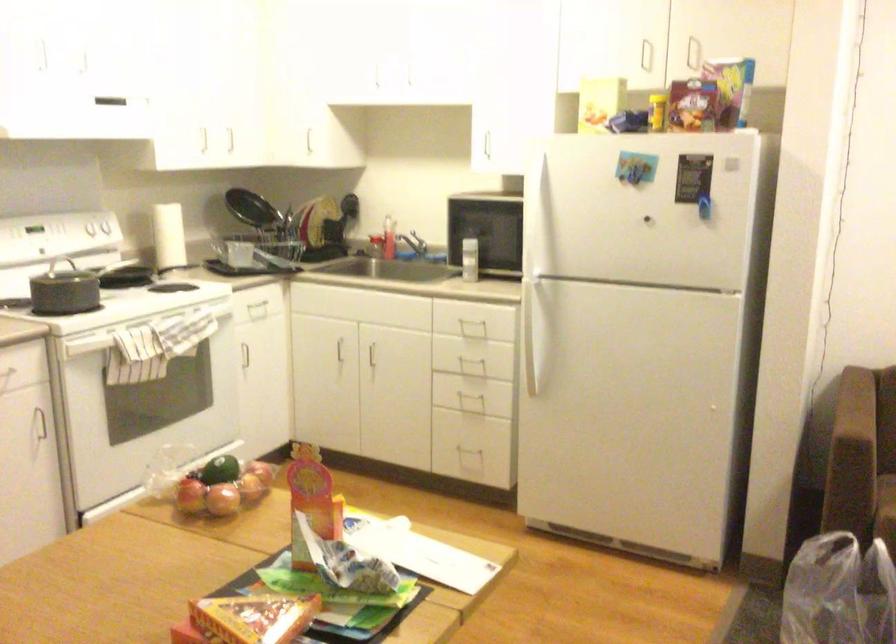
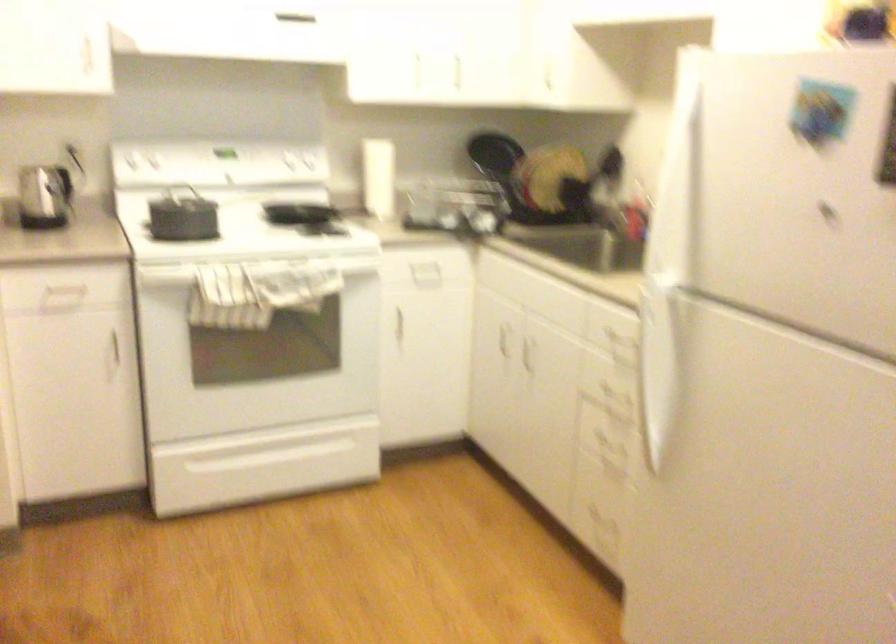
The point at (x=99, y=242) is marked in the first image. Where is the corresponding point in the second image?

(283, 169)